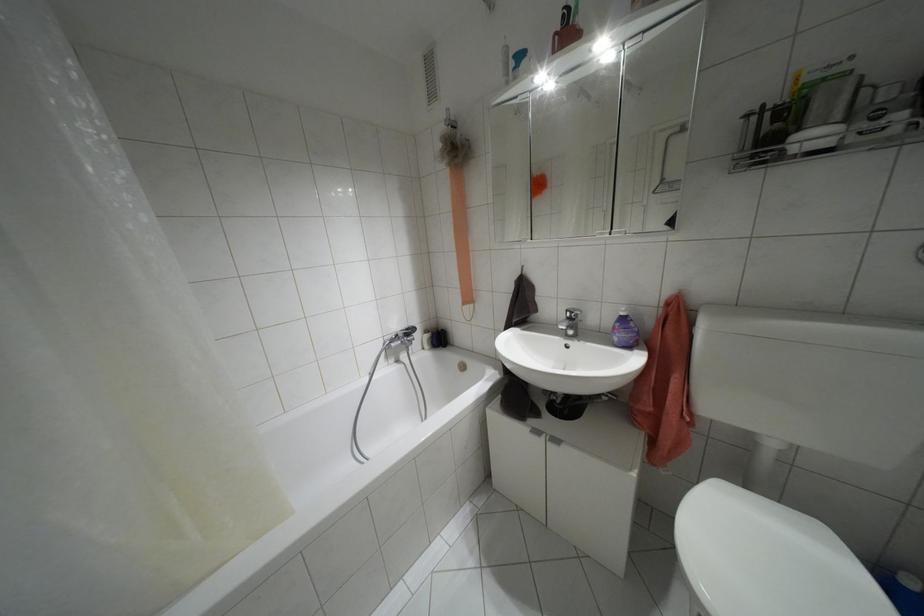
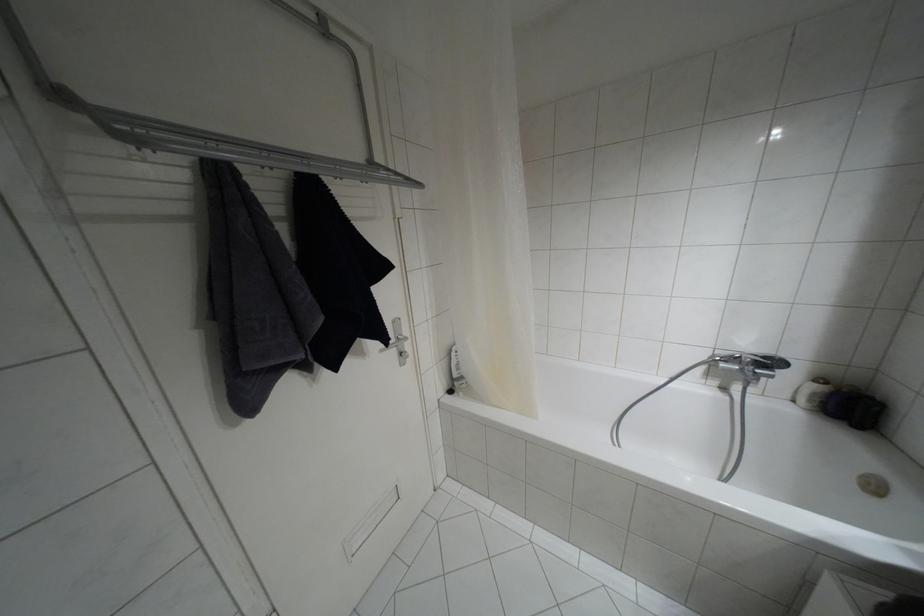
Find the pixel in the second image that matches pixel 426 331 in the first image.

(820, 379)